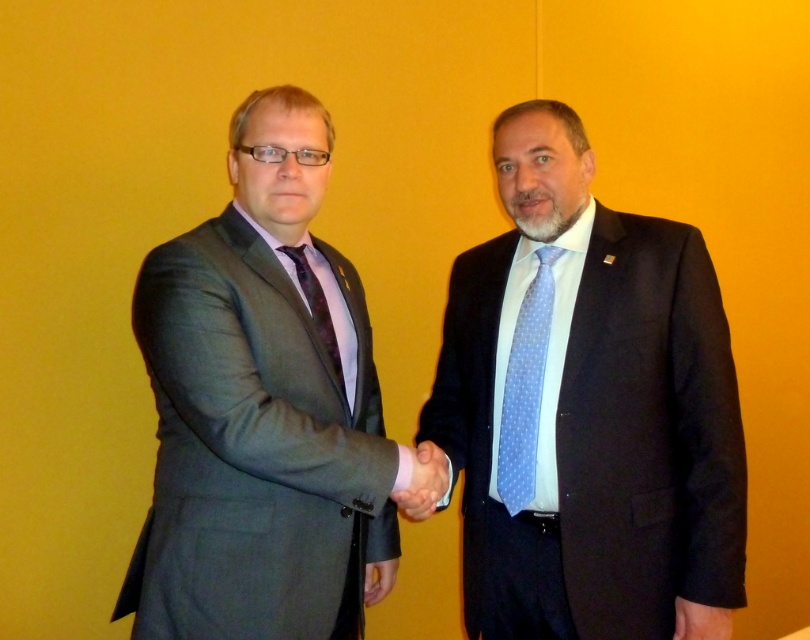
Is matte gray suit at left taller than matte purple tie at center?

Correct, matte gray suit at left is much taller as matte purple tie at center.

Who is more distant from viewer, [135,572] or [308,276]?

Positioned behind is point [308,276].

At what (x,y) coordinates should I click in order to perform the action: click on matte gray suit at left. Please return your answer as a coordinate pair (x, y). This screenshot has height=640, width=810. Looking at the image, I should click on (262, 408).

Who is higher up, dark blue suit at center or matte gray suit at left?

Positioned higher is dark blue suit at center.

Is dark blue suit at center wider than matte gray suit at left?

Yes, dark blue suit at center is wider than matte gray suit at left.

Who is more distant from viewer, (667,424) or (330,445)?

Positioned behind is point (667,424).

The image size is (810, 640). I want to click on dark blue suit at center, so click(x=589, y=412).

Describe the element at coordinates (262, 408) in the screenshot. I see `matte gray suit at left` at that location.

Does matte gray suit at left have a smaller size compared to blue dotted fabric tie at center?

Actually, matte gray suit at left might be larger than blue dotted fabric tie at center.

Between point (190, 564) and point (548, 248), which one is positioned behind?

The point (548, 248) is behind.

Find the location of a particular element. The height and width of the screenshot is (640, 810). matte gray suit at left is located at coordinates (262, 408).